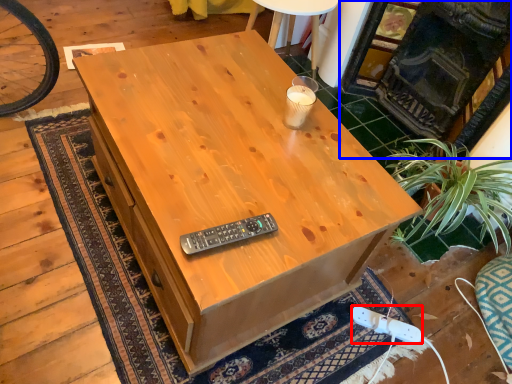
Question: Which object appears closest to the camera in this image, plug (highlighted by a red box) or fireplace (highlighted by a blue box)?

Choices:
 (A) plug
 (B) fireplace

Answer: (B)